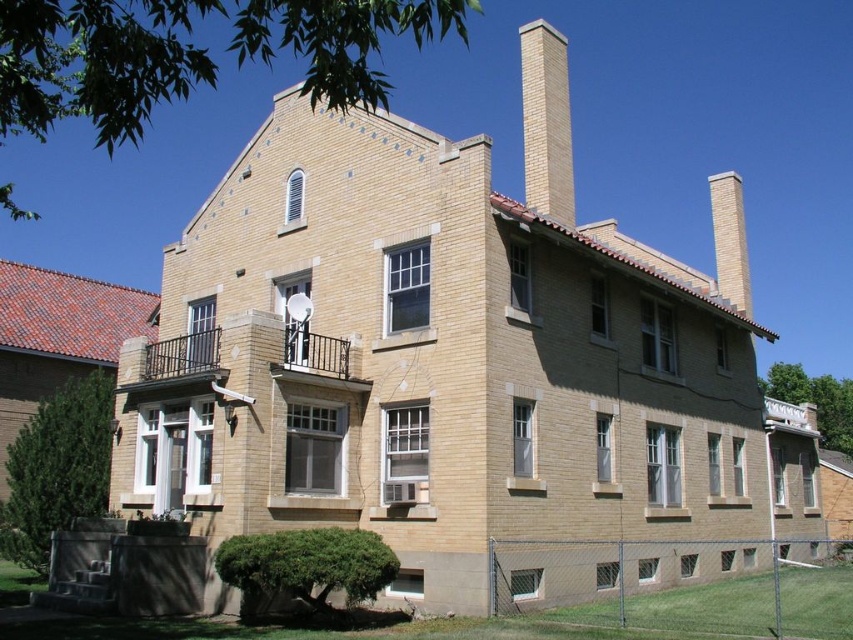
You are standing in front of the two story brick building and want to locate the point at coordinate point (677,584). Where would you find this point?

The point at coordinate point (677,584) is located on the metallic chain link fence at lower right.

You are standing in front of the two chimneys on the roof of the building. Which chimney is closer to you, the yellow brick chimney at upper center or the smooth tan brick chimney at upper right?

The yellow brick chimney at upper center is closer to you because it is in front of the smooth tan brick chimney at upper right.